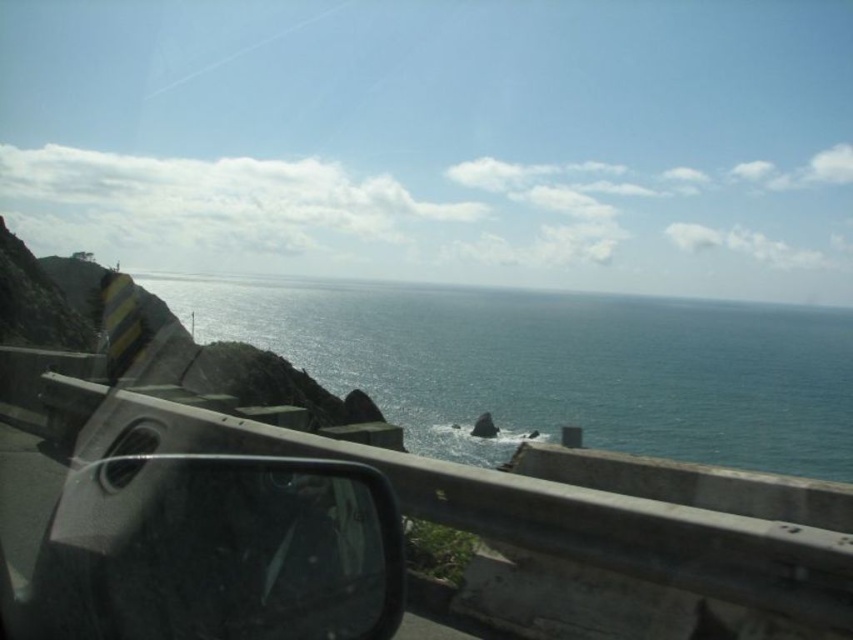
Question: From the image, what is the correct spatial relationship of blue water at center in relation to glossy plastic view mirror at lower left?

Choices:
 (A) above
 (B) below

Answer: (A)

Question: Is blue water at center bigger than glossy plastic view mirror at lower left?

Choices:
 (A) no
 (B) yes

Answer: (B)

Question: Among these objects, which one is nearest to the camera?

Choices:
 (A) blue water at center
 (B) glossy plastic view mirror at lower left

Answer: (B)

Question: Is blue water at center above glossy plastic view mirror at lower left?

Choices:
 (A) yes
 (B) no

Answer: (A)

Question: Which point appears closest to the camera in this image?

Choices:
 (A) (86, 477)
 (B) (381, 320)

Answer: (A)

Question: Which of the following is the closest to the observer?

Choices:
 (A) (270, 529)
 (B) (715, 349)

Answer: (A)